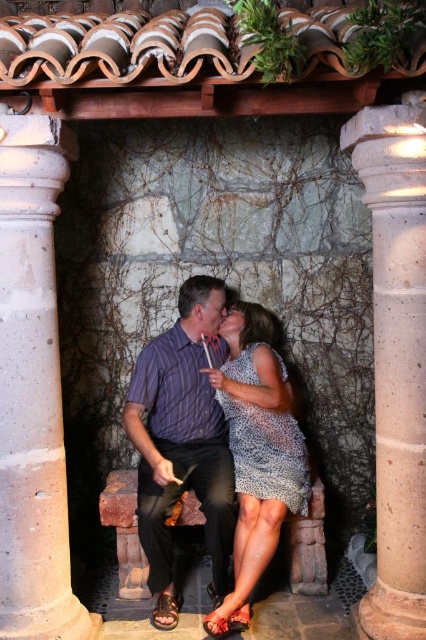
Does concrete column at center appear on the right side of printed fabric dress at center?

Incorrect, concrete column at center is not on the right side of printed fabric dress at center.

Is concrete column at center taller than printed fabric dress at center?

Indeed, concrete column at center has a greater height compared to printed fabric dress at center.

Is point (28, 360) positioned before point (261, 492)?

Yes.

Identify the location of concrete column at center. (32, 388).

The width and height of the screenshot is (426, 640). I want to click on concrete column at center, so click(32, 388).

Which of these two, concrete column at center or purple striped shirt at center, stands shorter?

purple striped shirt at center

Between point (54, 128) and point (189, 300), which one is positioned behind?

Positioned behind is point (189, 300).

The height and width of the screenshot is (640, 426). Identify the location of concrete column at center. (32, 388).

Who is shorter, white speckled stone column at right or printed fabric dress at center?

Standing shorter between the two is printed fabric dress at center.

Does white speckled stone column at right appear on the left side of printed fabric dress at center?

No, white speckled stone column at right is not to the left of printed fabric dress at center.

Which is in front, point (419, 572) or point (235, 416)?

Point (419, 572) is more forward.

The width and height of the screenshot is (426, 640). I want to click on white speckled stone column at right, so [396, 360].